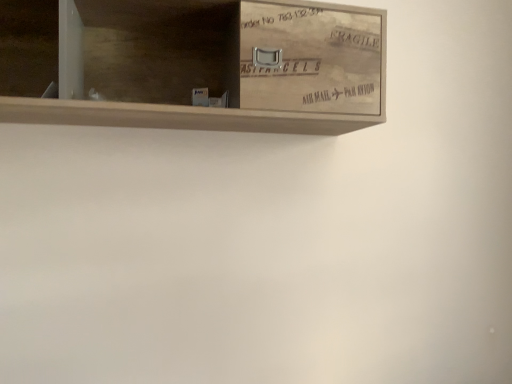
What do you see at coordinates (193, 64) in the screenshot? The height and width of the screenshot is (384, 512). I see `wooden crate at upper center` at bounding box center [193, 64].

Where is `wooden crate at upper center`? This screenshot has height=384, width=512. wooden crate at upper center is located at coordinates (193, 64).

The width and height of the screenshot is (512, 384). Identify the location of wooden crate at upper center. (193, 64).